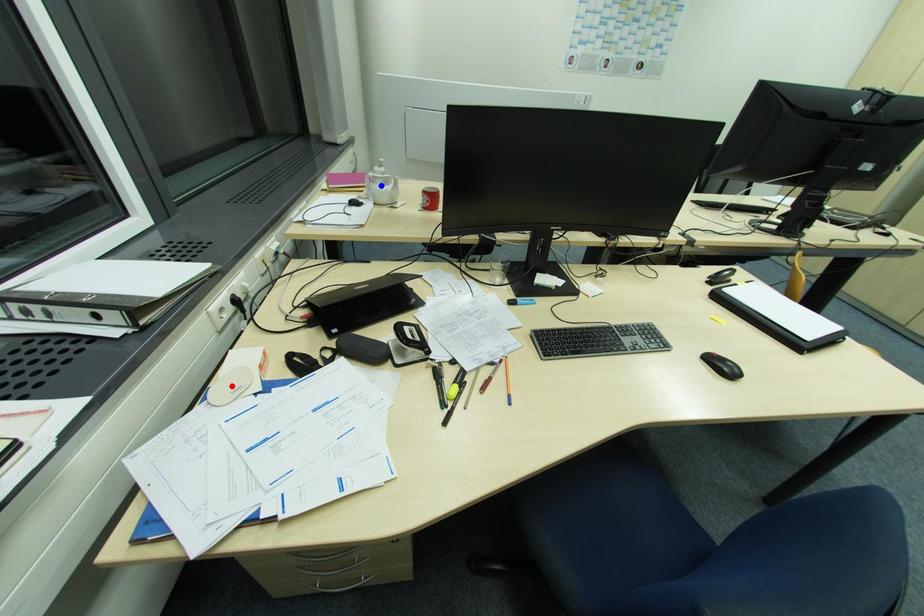
Question: In the image, two points are highlighted. Which point is nearer to the camera? Reply with the corresponding letter.

Choices:
 (A) blue point
 (B) red point

Answer: (B)